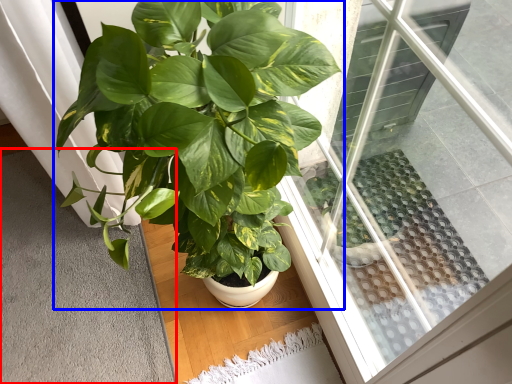
Question: Which point is further to the camera, gray (highlighted by a red box) or houseplant (highlighted by a blue box)?

Choices:
 (A) gray
 (B) houseplant

Answer: (A)